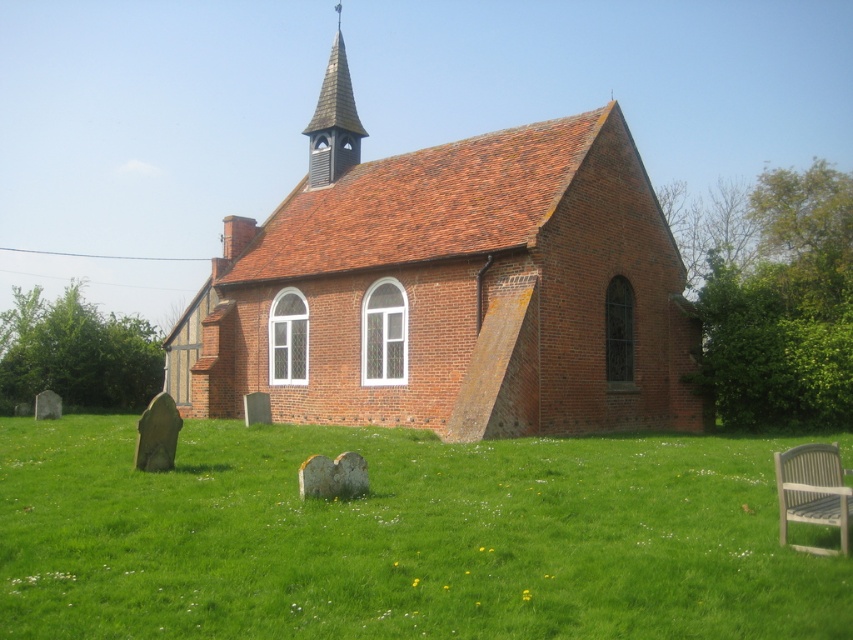
Does light gray plastic chair at lower right appear over wooden spire at upper center?

No, light gray plastic chair at lower right is not above wooden spire at upper center.

Is light gray plastic chair at lower right shorter than wooden spire at upper center?

Yes, light gray plastic chair at lower right is shorter than wooden spire at upper center.

In order to click on light gray plastic chair at lower right in this screenshot , I will do `click(811, 488)`.

Is point (312, 246) less distant than point (843, 538)?

No.

Is red brick church at center bigger than light gray plastic chair at lower right?

Yes.

At what (x,y) coordinates should I click in order to perform the action: click on red brick church at center. Please return your answer as a coordinate pair (x, y). Looking at the image, I should click on (450, 288).

Find the location of a particular element. This screenshot has width=853, height=640. green grass at lower center is located at coordinates (401, 538).

Can you confirm if green grass at lower center is wider than light gray plastic chair at lower right?

Yes, green grass at lower center is wider than light gray plastic chair at lower right.

Does point (548, 442) come farther from viewer compared to point (839, 474)?

Yes, it is behind point (839, 474).

Where is `green grass at lower center`? The width and height of the screenshot is (853, 640). green grass at lower center is located at coordinates (401, 538).